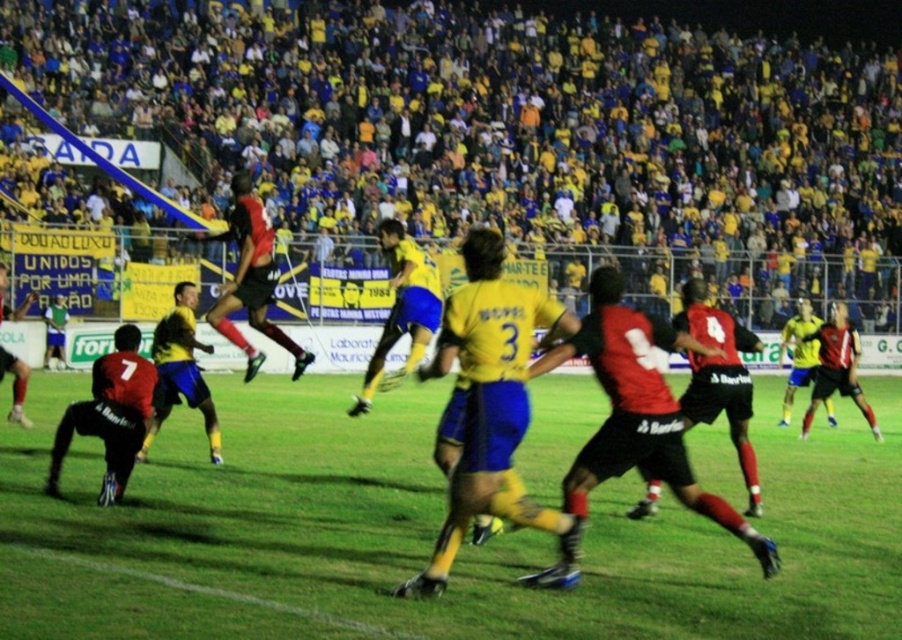
In the scene shown: You are a photographer positioned at the edge of the green grass football field at center. You want to take a photo of the matte black jersey at lower left. Which object is closer to your camera lens?

The green grass football field at center is closer to the viewer than the matte black jersey at lower left, so the photographer should adjust their focus to ensure the matte black jersey at lower left is in the foreground.

You are a drone operator trying to capture aerial footage of the soccer match. The green grass football field at center and the matte black jersey at lower left are both in your camera frame. Which object would appear larger in the footage?

The green grass football field at center would appear larger in the footage since it is bigger than the matte black jersey at lower left according to the description.

Looking at this image, you are a soccer referee positioned at the center circle. You need to decide which of the two points, point (670, 592) or point (150, 388), is closer to the goal located at the top of the field. Based on their positions, which point is nearer to the goal?

Point (670, 592) is in front of point (150, 388), so it is closer to the goal located at the top of the field.